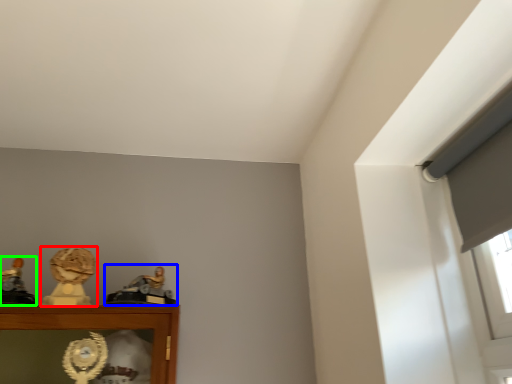
Question: Considering the real-world distances, which object is closest to character sculpture (highlighted by a red box)? character sculpture (highlighted by a blue box) or character sculpture (highlighted by a green box).

Choices:
 (A) character sculpture
 (B) character sculpture

Answer: (A)